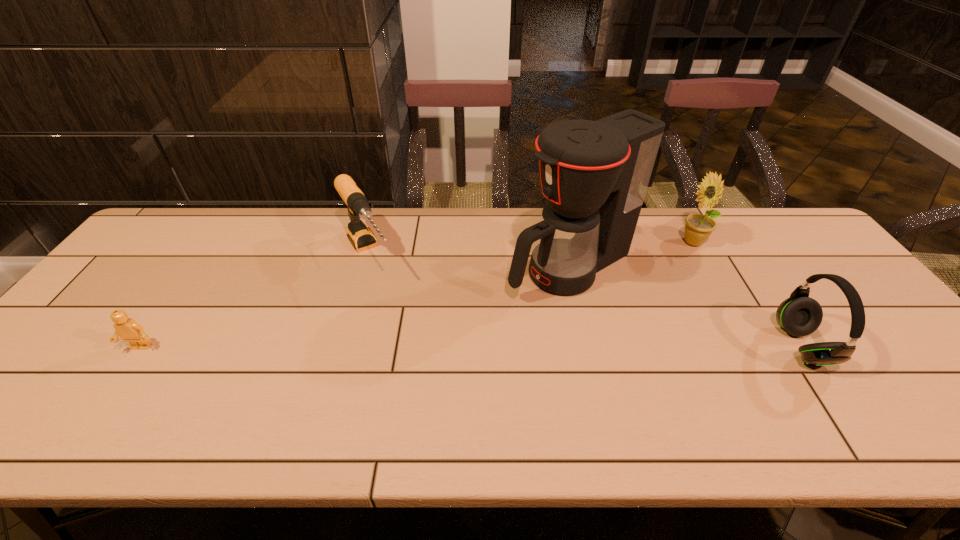
Find the location of a particular element. The height and width of the screenshot is (540, 960). Lego is located at coordinates (128, 329).

Identify the location of the leftmost object. (128, 329).

The height and width of the screenshot is (540, 960). In order to click on headset in this screenshot , I will do `click(799, 315)`.

Find the location of a particular element. the tallest object is located at coordinates (594, 175).

At what (x,y) coordinates should I click in order to perform the action: click on the third object from left to right. Please return your answer as a coordinate pair (x, y). Looking at the image, I should click on (594, 175).

Find the location of `sunflower`. sunflower is located at coordinates (698, 227).

Identify the location of the fourth object from right to left. The image size is (960, 540). (361, 237).

The width and height of the screenshot is (960, 540). In order to click on free space located 0.050m on the face of the Lego in this screenshot , I will do `click(124, 372)`.

Find the location of `free region located on the ear cups of the headset`. free region located on the ear cups of the headset is located at coordinates (876, 346).

Locate an element on the screen. This screenshot has height=540, width=960. free space located 0.090m pour from the carafe of the coffee maker is located at coordinates (493, 303).